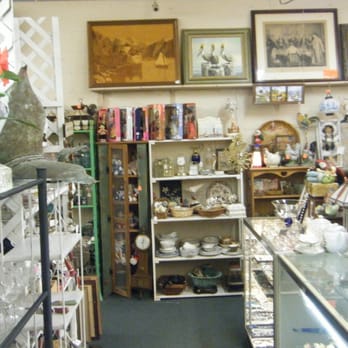
The height and width of the screenshot is (348, 348). Identify the location of pictures. (293, 27), (187, 68), (142, 62).